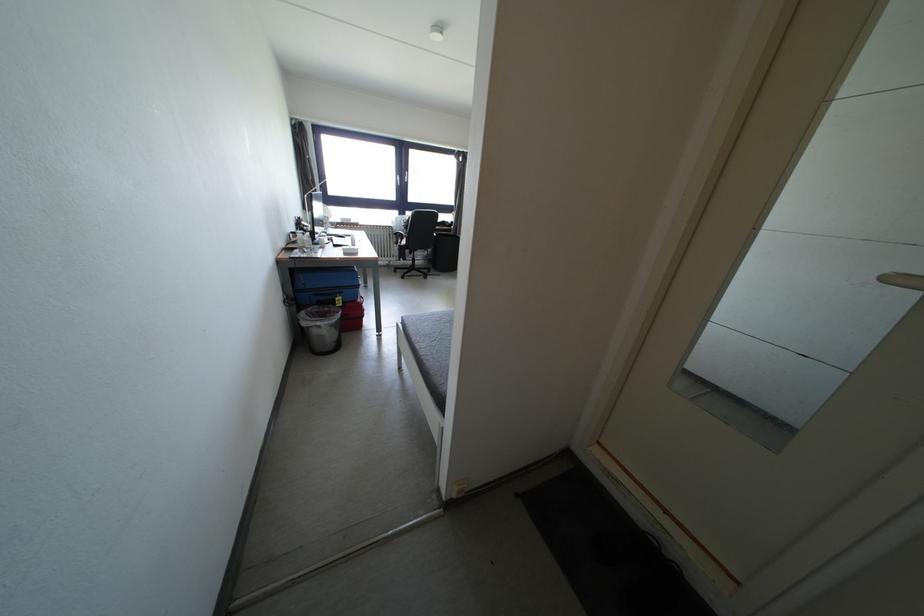
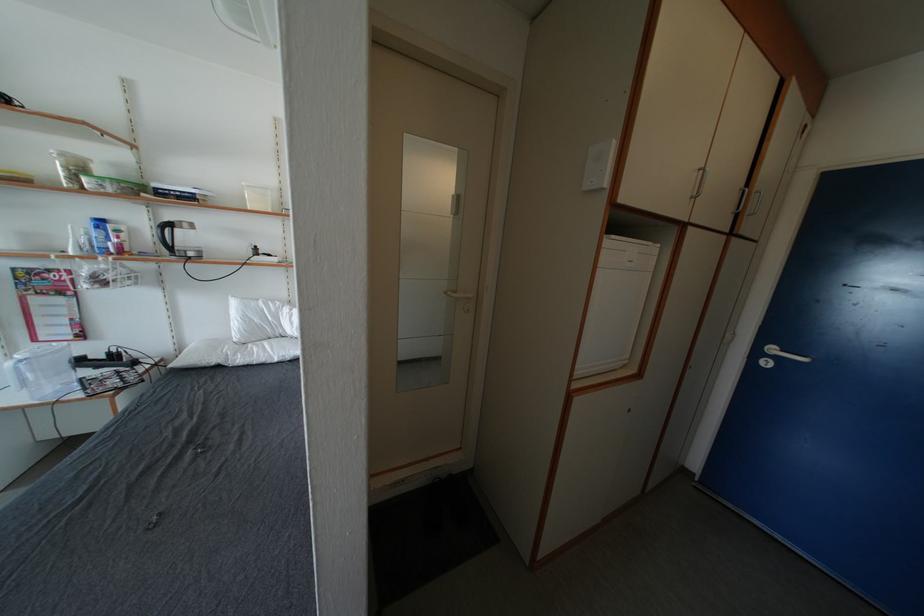
Based on the continuous images, in which direction is the camera rotating?

The rotation direction of the camera is right-down.